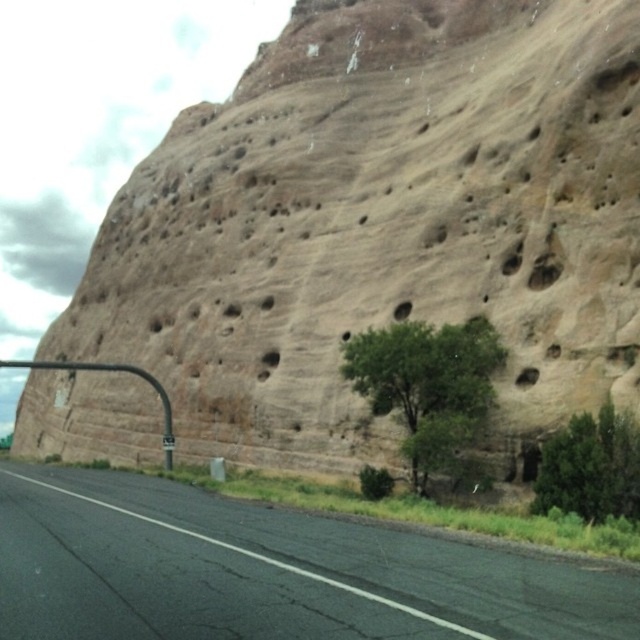
Is black asphalt road at center positioned at the back of green leafy tree at center?

No, it is in front of green leafy tree at center.

Is black asphalt road at center to the right of green leafy tree at center from the viewer's perspective?

No, black asphalt road at center is not to the right of green leafy tree at center.

Is point (131, 540) farther from viewer compared to point (362, 353)?

No, (131, 540) is closer to viewer.

Find the location of a particular element. This screenshot has width=640, height=640. black asphalt road at center is located at coordinates (266, 572).

This screenshot has height=640, width=640. What do you see at coordinates (428, 385) in the screenshot?
I see `green leafy tree at center` at bounding box center [428, 385].

Image resolution: width=640 pixels, height=640 pixels. Identify the location of green leafy tree at center. (428, 385).

Which is behind, point (353, 348) or point (620, 497)?

Positioned behind is point (353, 348).

Find the location of a particular element. This screenshot has width=640, height=640. green leafy tree at center is located at coordinates (428, 385).

Consider the image. Who is taller, black asphalt road at center or green leafy tree at lower right?

green leafy tree at lower right is taller.

Who is positioned more to the right, black asphalt road at center or green leafy tree at lower right?

green leafy tree at lower right is more to the right.

Does point (444, 605) lie behind point (538, 492)?

No, it is in front of (538, 492).

This screenshot has height=640, width=640. I want to click on black asphalt road at center, so click(x=266, y=572).